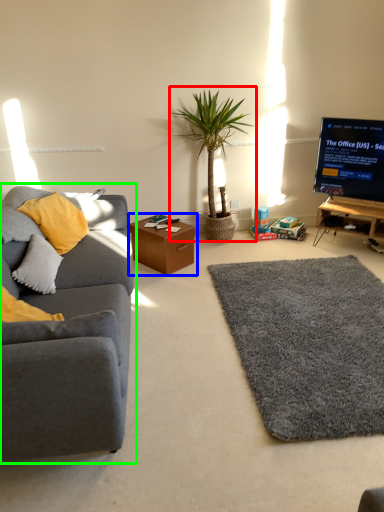
Question: Estimate the real-world distances between objects in this image. Which object is farther from houseplant (highlighted by a red box), table (highlighted by a blue box) or studio couch (highlighted by a green box)?

Choices:
 (A) table
 (B) studio couch

Answer: (B)